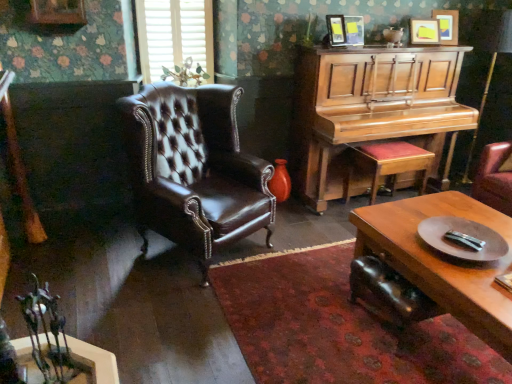
Locate an element on the screen. vacant space to the right of brown leather chair at left is located at coordinates (298, 267).